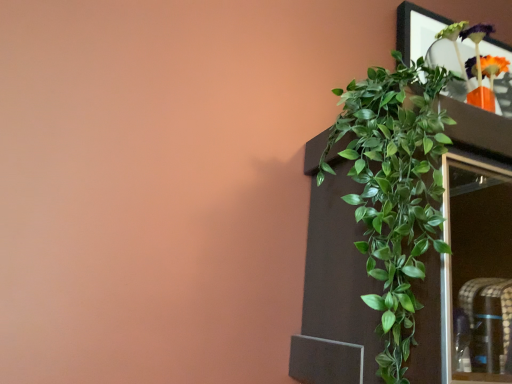
In order to click on green leafy plant at upper right in this screenshot , I will do `click(395, 191)`.

What do you see at coordinates (395, 191) in the screenshot? The width and height of the screenshot is (512, 384). I see `green leafy plant at upper right` at bounding box center [395, 191].

Identify the location of green leafy plant at upper right. The image size is (512, 384). (395, 191).